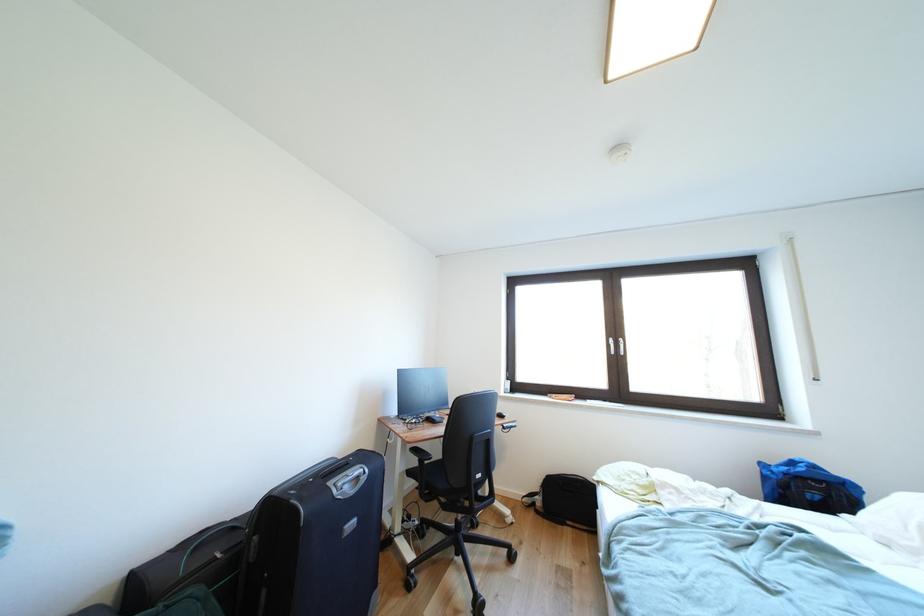
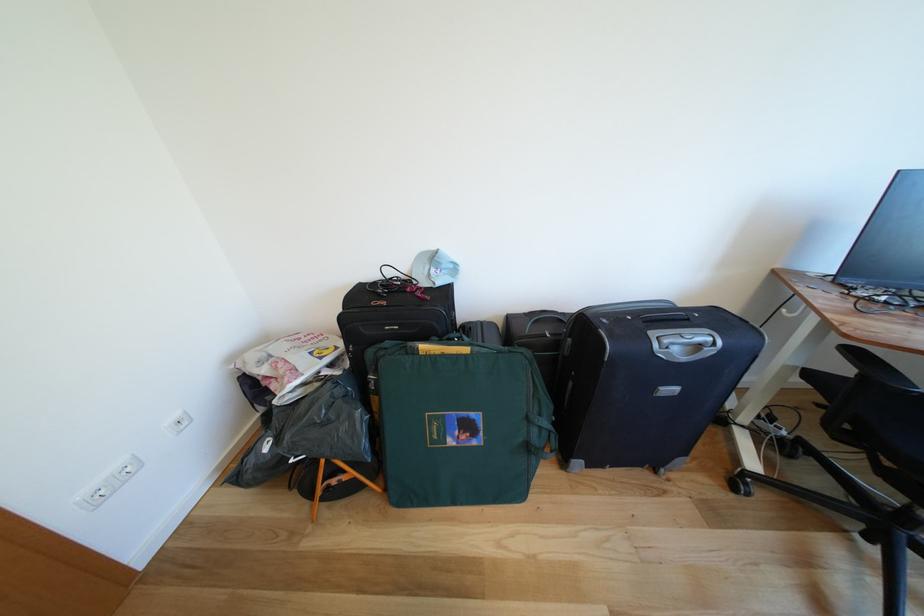
Locate, in the second image, the point that corresponds to the point at 423,455 in the first image.

(862, 357)